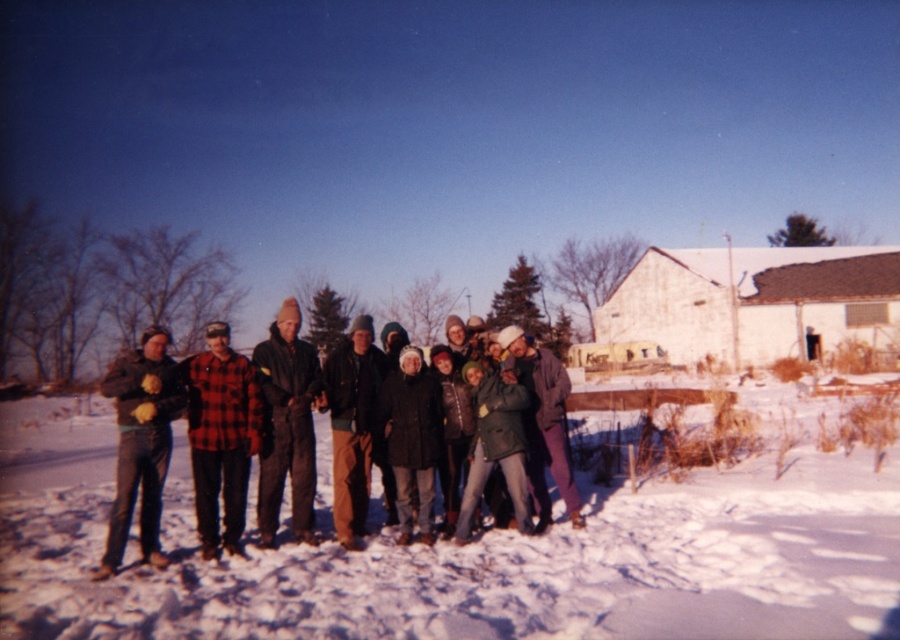
Question: Which point is closer to the camera taking this photo?

Choices:
 (A) (150, 506)
 (B) (266, 547)

Answer: (A)

Question: Can you confirm if dark gray woolen jacket at left is positioned below flannel shirt at center?

Choices:
 (A) yes
 (B) no

Answer: (A)

Question: Among these points, which one is nearest to the camera?

Choices:
 (A) (459, 556)
 (B) (339, 429)
 (C) (411, 396)
 (D) (223, 452)

Answer: (A)

Question: Is plaid flannel shirt at center thinner than matte gray jacket at center?

Choices:
 (A) yes
 (B) no

Answer: (B)

Question: Which point is closer to the camera taking this photo?

Choices:
 (A) (195, 390)
 (B) (270, 541)
 (C) (230, 356)

Answer: (A)

Question: Can you confirm if white fluffy snow at center is bigger than matte gray jacket at center?

Choices:
 (A) no
 (B) yes

Answer: (B)